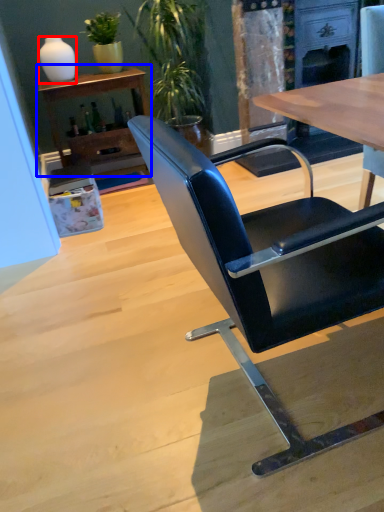
Question: Which point is closer to the camera, vase (highlighted by a red box) or shelf (highlighted by a blue box)?

Choices:
 (A) vase
 (B) shelf

Answer: (B)